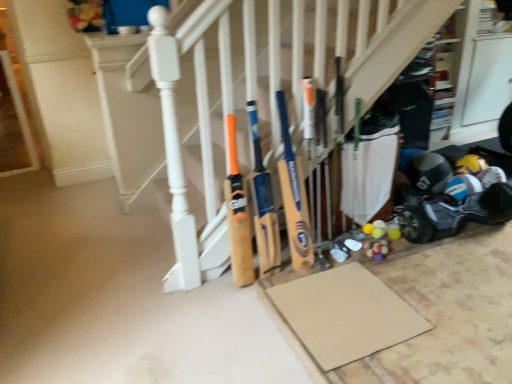
Question: Is the depth of yellow wood bat at center, which is the 1th baseball bat from right to left, less than that of blue plastic baby carriage at lower right?

Choices:
 (A) yes
 (B) no

Answer: (A)

Question: Does yellow wood bat at center, which is the second baseball bat from left to right, have a greater width compared to blue plastic baby carriage at lower right?

Choices:
 (A) yes
 (B) no

Answer: (B)

Question: Are yellow wood bat at center, which is the second baseball bat from left to right, and blue plastic baby carriage at lower right far apart?

Choices:
 (A) no
 (B) yes

Answer: (A)

Question: Is yellow wood bat at center, which is the 1th baseball bat from right to left, next to blue plastic baby carriage at lower right?

Choices:
 (A) yes
 (B) no

Answer: (B)

Question: Can you confirm if yellow wood bat at center, which is the 1th baseball bat from right to left, is smaller than blue plastic baby carriage at lower right?

Choices:
 (A) yes
 (B) no

Answer: (A)

Question: Looking at the image, does yellow wood bat at center, which is the second baseball bat from left to right, seem bigger or smaller compared to matte black helmet at lower right?

Choices:
 (A) small
 (B) big

Answer: (B)

Question: From the image's perspective, is yellow wood bat at center, which is the second baseball bat from left to right, above or below matte black helmet at lower right?

Choices:
 (A) above
 (B) below

Answer: (B)

Question: Is yellow wood bat at center, which is the second baseball bat from left to right, situated inside matte black helmet at lower right or outside?

Choices:
 (A) inside
 (B) outside

Answer: (B)

Question: Visually, is yellow wood bat at center, which is the 1th baseball bat from right to left, positioned to the left or to the right of matte black helmet at lower right?

Choices:
 (A) right
 (B) left

Answer: (B)

Question: Is blue plastic baby carriage at lower right taller or shorter than wooden bats at center?

Choices:
 (A) tall
 (B) short

Answer: (B)

Question: From a real-world perspective, is blue plastic baby carriage at lower right positioned above or below wooden bats at center?

Choices:
 (A) below
 (B) above

Answer: (A)

Question: Is blue plastic baby carriage at lower right in front of or behind wooden bats at center in the image?

Choices:
 (A) behind
 (B) front

Answer: (A)

Question: Is blue plastic baby carriage at lower right to the left or to the right of wooden bats at center in the image?

Choices:
 (A) left
 (B) right

Answer: (B)

Question: Considering the relative positions of yellow wood bat at center, which is the 1th baseball bat from right to left, and wooden bat at center, the 1th baseball bat from the left, in the image provided, is yellow wood bat at center, which is the 1th baseball bat from right to left, to the left or to the right of wooden bat at center, the 1th baseball bat from the left,?

Choices:
 (A) right
 (B) left

Answer: (A)

Question: Considering the positions of yellow wood bat at center, which is the 1th baseball bat from right to left, and wooden bat at center, the second baseball bat positioned from the right, in the image, is yellow wood bat at center, which is the 1th baseball bat from right to left, taller or shorter than wooden bat at center, the second baseball bat positioned from the right,?

Choices:
 (A) short
 (B) tall

Answer: (B)